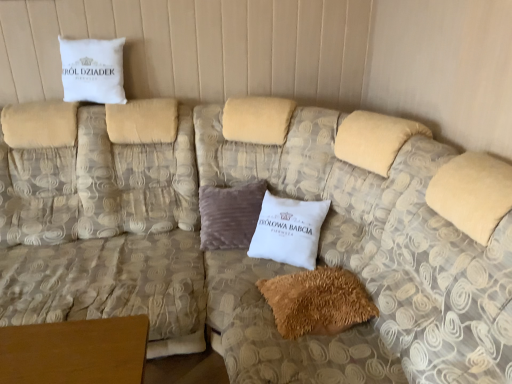
Question: From the image's perspective, is brown fuzzy pillow at lower center, the second pillow when ordered from back to front, located above or below white cotton pillow at upper left, the 1th pillow in the back-to-front sequence?

Choices:
 (A) above
 (B) below

Answer: (B)

Question: From a real-world perspective, is brown fuzzy pillow at lower center, which is the 1th pillow from front to back, above or below white cotton pillow at upper left, which appears as the first pillow when viewed from the left?

Choices:
 (A) above
 (B) below

Answer: (B)

Question: Which of these objects is positioned farthest from the white cotton pillow at upper left, the 1th pillow in the back-to-front sequence?

Choices:
 (A) brown fuzzy pillow at lower center, which ranks as the 1th pillow in bottom-to-top order
 (B) beige fabric couch at upper left

Answer: (A)

Question: Which object is positioned closest to the brown fuzzy pillow at lower center, which is the 1th pillow from front to back?

Choices:
 (A) white cotton pillow at upper left, which ranks as the second pillow in front-to-back order
 (B) beige fabric couch at upper left

Answer: (B)